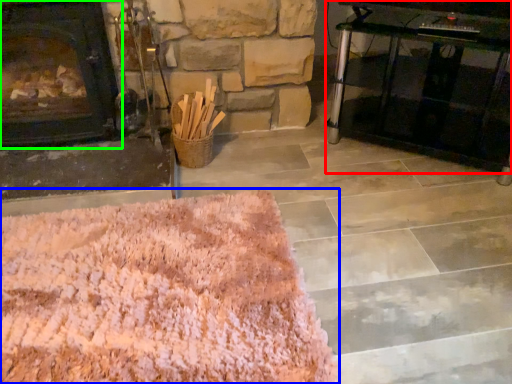
Question: Which object is the closest to the table (highlighted by a red box)? Choose among these: mat (highlighted by a blue box) or fireplace (highlighted by a green box).

Choices:
 (A) mat
 (B) fireplace

Answer: (A)